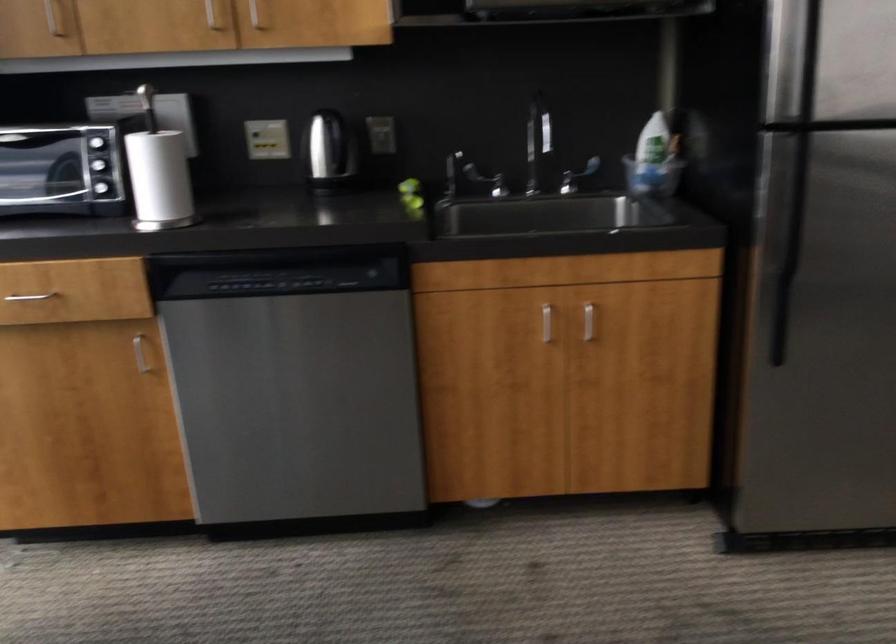
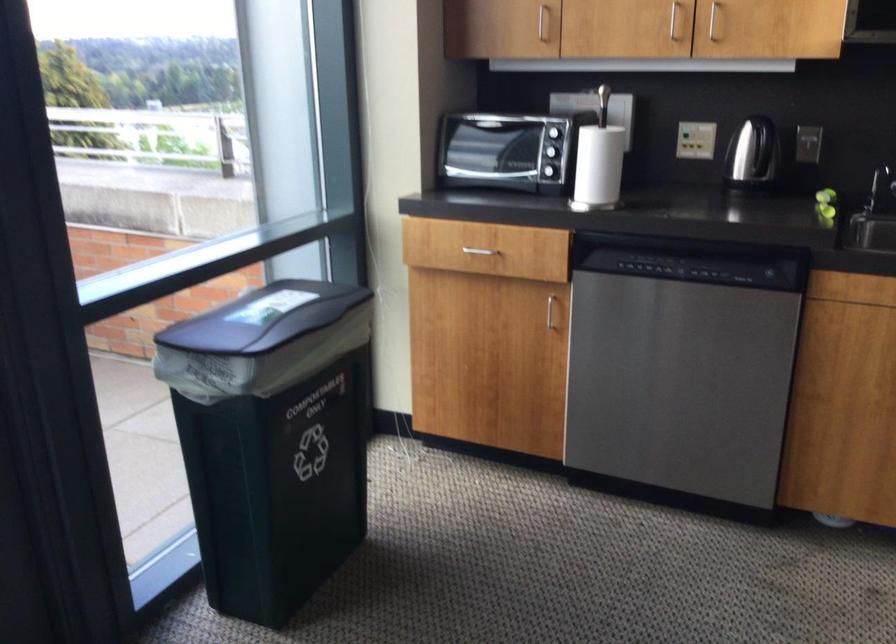
The point at (452, 180) is marked in the first image. Where is the corresponding point in the second image?

(879, 187)